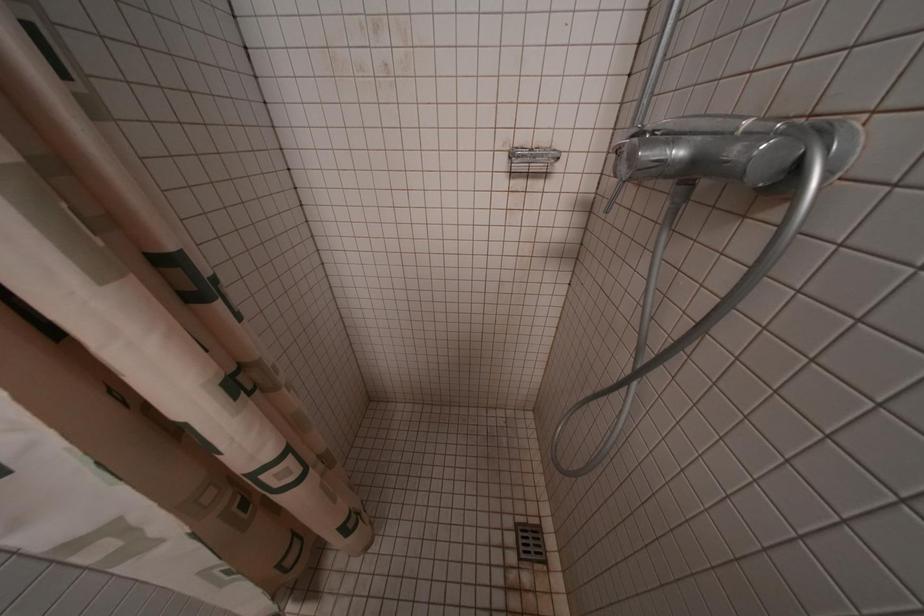
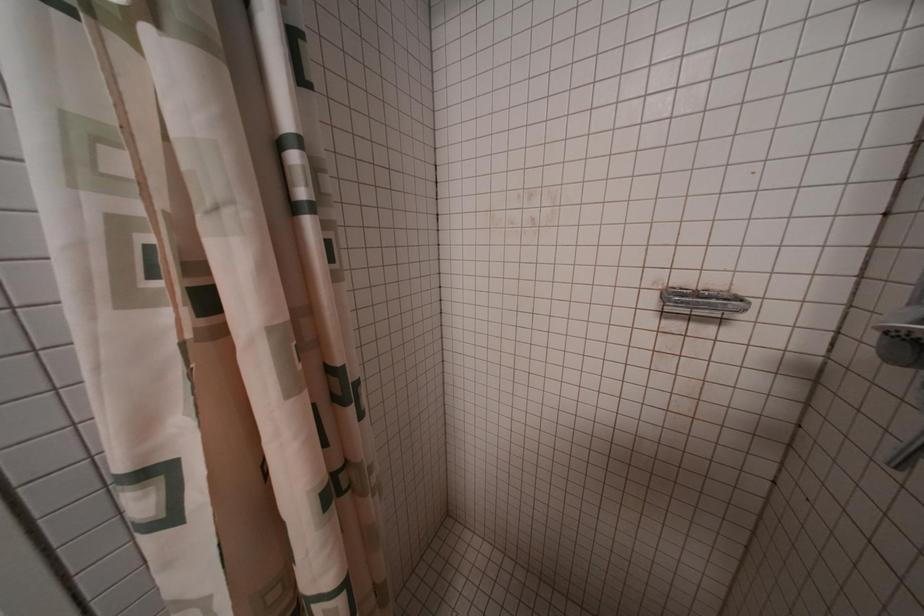
Based on the photo, how did the camera likely rotate?

The rotation direction of the camera is left-up.